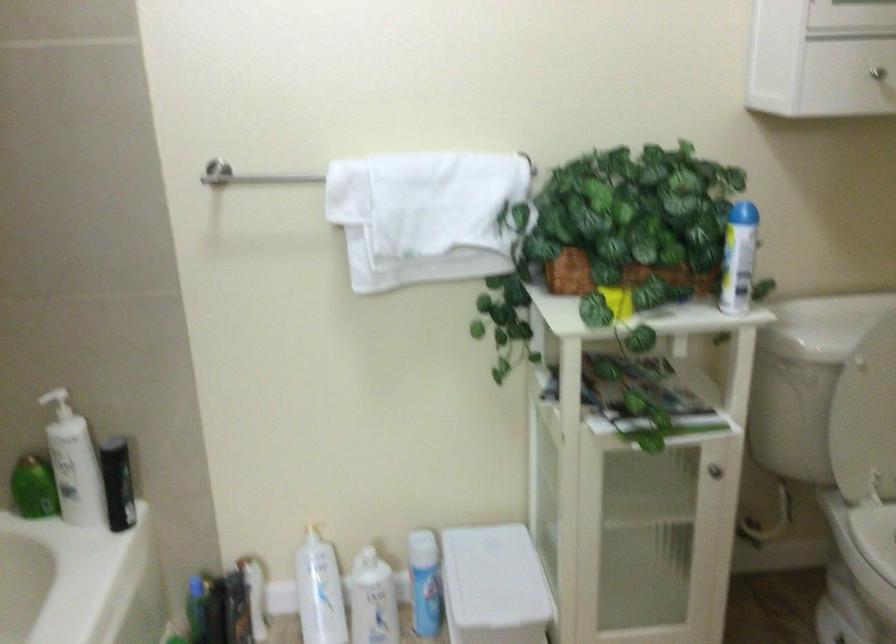
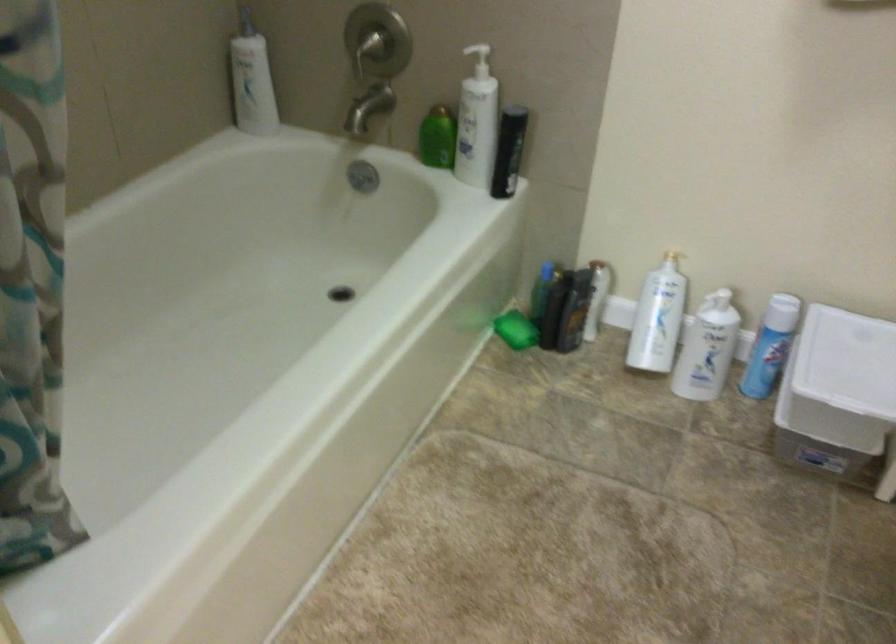
Locate, in the second image, the point that corresponds to (x=81, y=462) in the first image.

(477, 122)